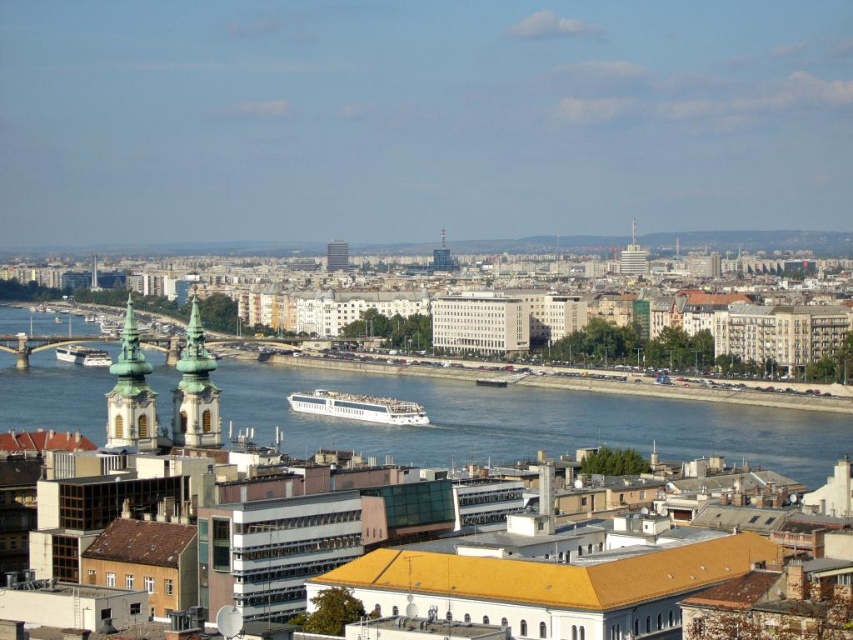
Question: Which object is the farthest from the green stone tower at center-left?

Choices:
 (A) white glossy cruise ship at center
 (B) blue waterway at center
 (C) white glossy cruise ship at lower left
 (D) smooth glass skyscraper at center

Answer: (D)

Question: Based on their relative distances, which object is farther from the silver metallic tower at upper right?

Choices:
 (A) smooth glass skyscraper at center
 (B) white glossy cruise ship at center
 (C) green stone tower at center-left

Answer: (C)

Question: Is silver metallic tower at upper right behind smooth glass skyscraper at center?

Choices:
 (A) no
 (B) yes

Answer: (B)

Question: Which object appears farthest from the camera in this image?

Choices:
 (A) smooth glass skyscraper at center
 (B) green stone tower at center

Answer: (A)

Question: Is blue waterway at center thinner than green stone tower at center?

Choices:
 (A) yes
 (B) no

Answer: (B)

Question: Where is white glossy cruise ship at center located in relation to matte glass skyscraper at center in the image?

Choices:
 (A) left
 (B) right

Answer: (B)